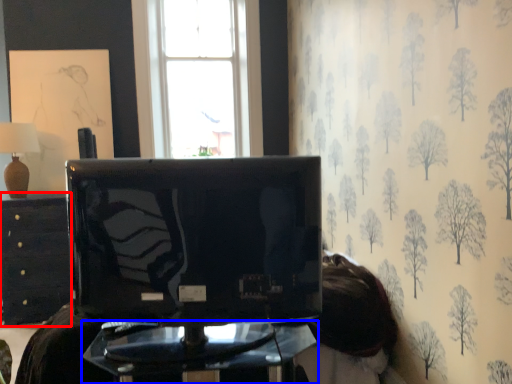
Question: Among these objects, which one is nearest to the camera, furniture (highlighted by a red box) or furniture (highlighted by a blue box)?

Choices:
 (A) furniture
 (B) furniture

Answer: (B)